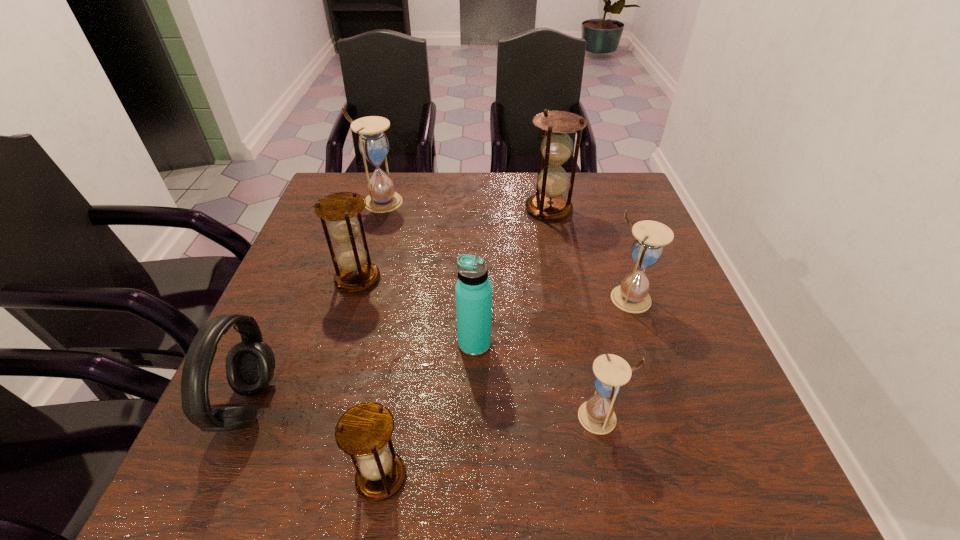
This screenshot has height=540, width=960. Identify the location of blank area in the image that satisfies the following two spatial constraints: 1. on the earcups of the third hourglass from left to right; 2. on the right side of the gray headset. (219, 477).

This screenshot has width=960, height=540. Identify the location of vacant region that satisfies the following two spatial constraints: 1. on the earcups of the leftmost object; 2. on the back side of the nearest hourglass. (219, 477).